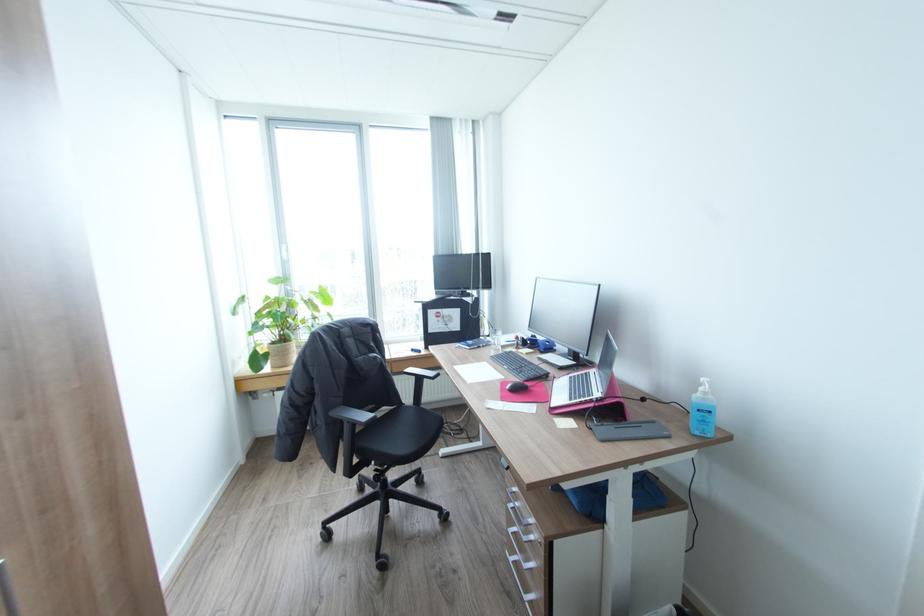
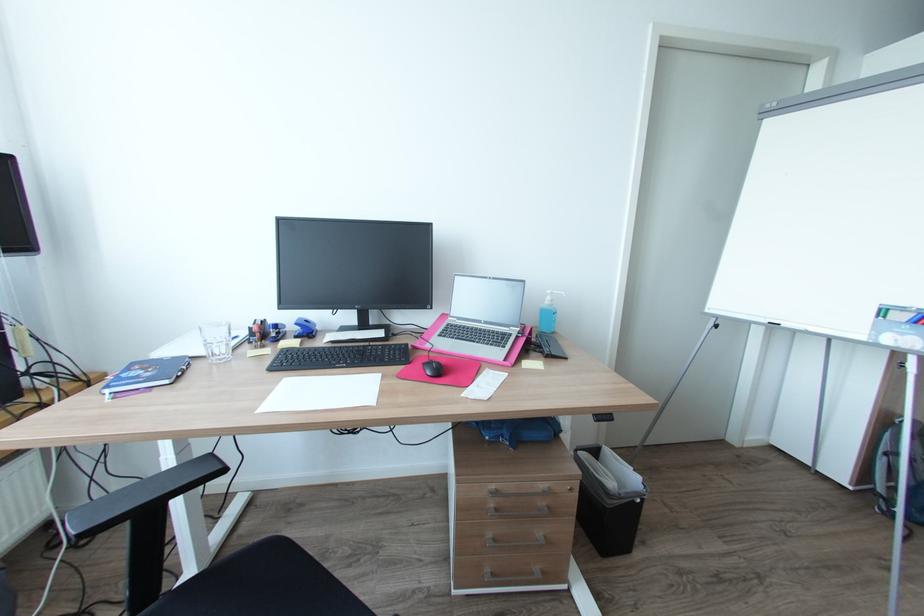
Find the pixel in the second image that matches point 542,350 in the first image.

(301, 337)